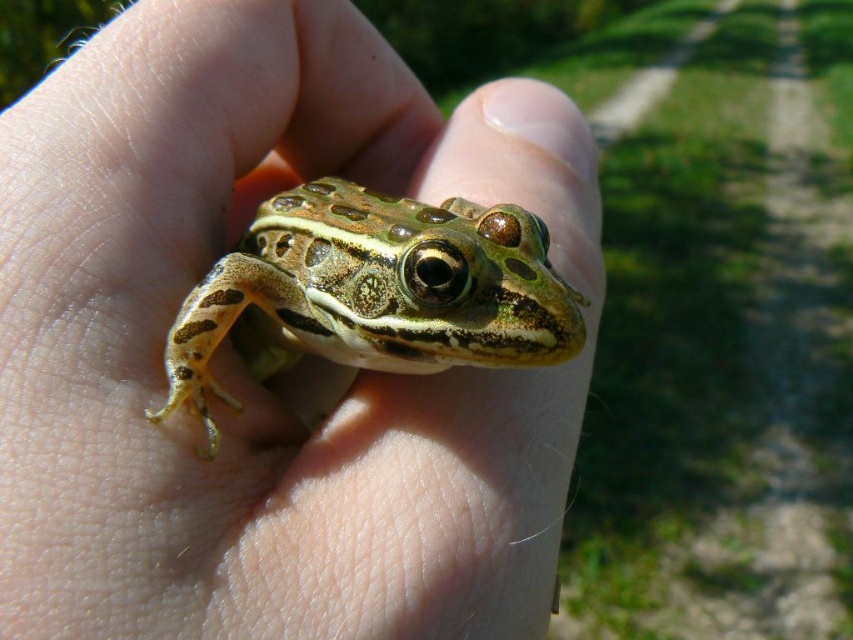
You are a biologist examining a frog in the wild. You notice two areas of skin on the frog. One has a matte texture and is labeled as the green matte skin at center, while the other has spots and is labeled as the green spotted skin at center. Which of these two skin areas is positioned to the left?

The green matte skin at center is positioned to the left of the green spotted skin at center.

You are a biologist studying frog species and need to measure the distance between the green matte skin at center and the green spotted skin at center. According to the image, how far apart are these two skin textures?

A: The green matte skin at center and the green spotted skin at center are 11.25 centimeters apart from each other.

You are a biologist observing a frog in the wild. You notice two skin patches on the frog, one labeled as green matte skin at center and the other as green spotted skin at center. Which of these two skin patches is larger?

The green matte skin at center is bigger than the green spotted skin at center, so the green matte skin at center is the larger one.